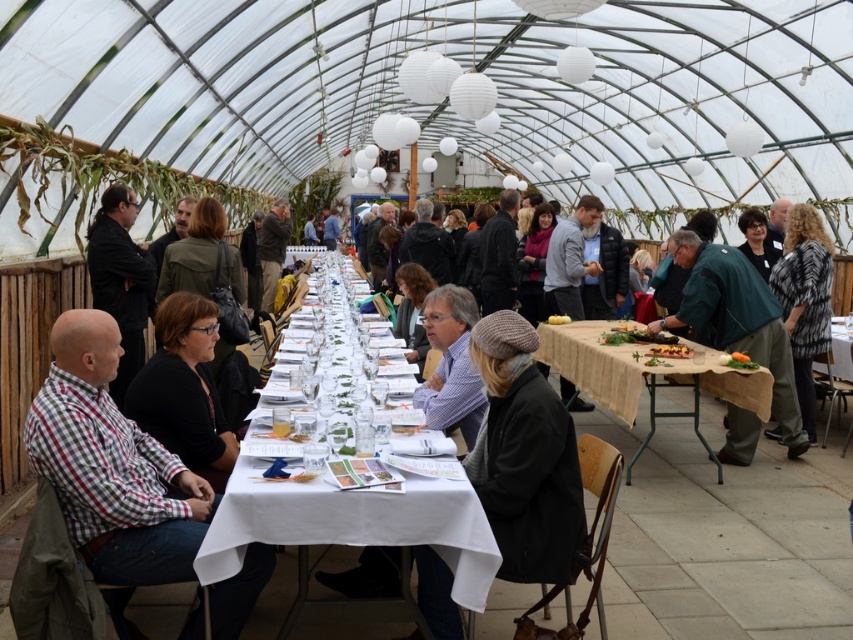
Between black fabric jacket at lower left and smooth yellow cheese at center, which one has less height?

smooth yellow cheese at center

Which is above, black fabric jacket at lower left or smooth yellow cheese at center?

Positioned higher is smooth yellow cheese at center.

Describe the element at coordinates (184, 388) in the screenshot. I see `black fabric jacket at lower left` at that location.

The image size is (853, 640). In order to click on black fabric jacket at lower left in this screenshot , I will do `click(184, 388)`.

Consider the image. Does printed fur coat at right have a larger size compared to green matte carrot at center?

Correct, printed fur coat at right is larger in size than green matte carrot at center.

Is point (799, 218) closer to camera compared to point (741, 355)?

No, it is not.

Is point (779, 284) farther from camera compared to point (744, 365)?

Yes, point (779, 284) is farther from viewer.

Locate an element on the screen. The image size is (853, 640). printed fur coat at right is located at coordinates (804, 300).

Does checkered fabric shirt at left appear under printed fur coat at right?

Correct, checkered fabric shirt at left is located below printed fur coat at right.

Is point (126, 461) closer to viewer compared to point (824, 337)?

Yes.

The width and height of the screenshot is (853, 640). Describe the element at coordinates (112, 468) in the screenshot. I see `checkered fabric shirt at left` at that location.

This screenshot has height=640, width=853. I want to click on checkered fabric shirt at left, so click(x=112, y=468).